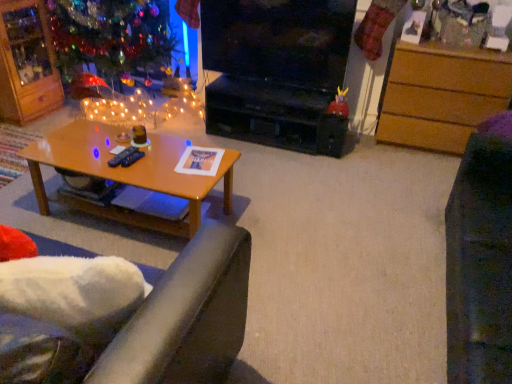
Where is `free space to the left of black plastic remote control at center, the 2th remote control viewed from the left`? free space to the left of black plastic remote control at center, the 2th remote control viewed from the left is located at coordinates (91, 155).